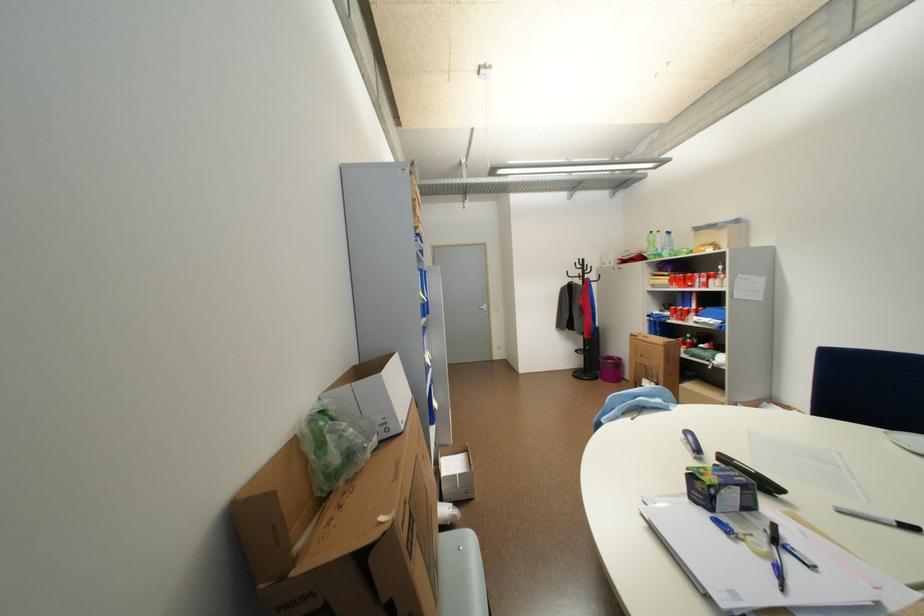
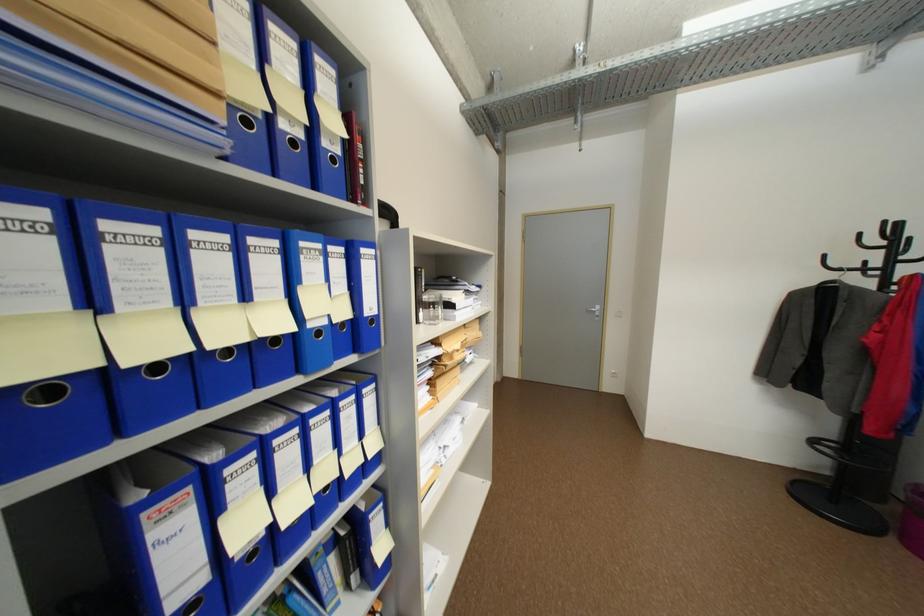
Where in the second image is the point corresponding to point 588,278 from the first image?

(873, 270)